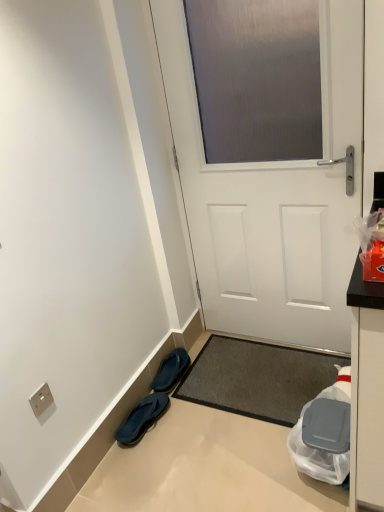
Question: Is blue rubber flip-flops at lower left, the second footwear in the front-to-back sequence, next to dark gray textured mat at center?

Choices:
 (A) yes
 (B) no

Answer: (B)

Question: Is blue rubber flip-flops at lower left, arranged as the first footwear when viewed from the back, far away from dark gray textured mat at center?

Choices:
 (A) no
 (B) yes

Answer: (A)

Question: From the image's perspective, is blue rubber flip-flops at lower left, arranged as the first footwear when viewed from the back, below dark gray textured mat at center?

Choices:
 (A) yes
 (B) no

Answer: (B)

Question: Can dark gray textured mat at center be found inside blue rubber flip-flops at lower left, the second footwear in the front-to-back sequence?

Choices:
 (A) no
 (B) yes

Answer: (A)

Question: Is blue rubber flip-flops at lower left, the second footwear in the front-to-back sequence, shorter than dark gray textured mat at center?

Choices:
 (A) no
 (B) yes

Answer: (A)

Question: Is blue rubber flip-flops at lower left, arranged as the first footwear when viewed from the back, in front of or behind white matte door at center in the image?

Choices:
 (A) behind
 (B) front

Answer: (A)

Question: From a real-world perspective, is blue rubber flip-flops at lower left, the second footwear in the front-to-back sequence, positioned above or below white matte door at center?

Choices:
 (A) above
 (B) below

Answer: (B)

Question: From the image's perspective, is blue rubber flip-flops at lower left, the second footwear in the front-to-back sequence, above or below white matte door at center?

Choices:
 (A) above
 (B) below

Answer: (B)

Question: From their relative heights in the image, would you say blue rubber flip-flops at lower left, the second footwear in the front-to-back sequence, is taller or shorter than white matte door at center?

Choices:
 (A) tall
 (B) short

Answer: (B)

Question: Is blue rubber flip-flops at lower left, the second footwear in the front-to-back sequence, in front of or behind silver metallic electric outlet at lower left in the image?

Choices:
 (A) front
 (B) behind

Answer: (B)

Question: Is point (180, 353) positioned closer to the camera than point (39, 409)?

Choices:
 (A) closer
 (B) farther

Answer: (B)

Question: Based on their positions, is blue rubber flip-flops at lower left, arranged as the first footwear when viewed from the back, located to the left or right of silver metallic electric outlet at lower left?

Choices:
 (A) left
 (B) right

Answer: (B)

Question: Do you think blue rubber flip-flops at lower left, the second footwear in the front-to-back sequence, is within silver metallic electric outlet at lower left, or outside of it?

Choices:
 (A) inside
 (B) outside

Answer: (B)

Question: Choose the correct answer: Is blue rubber flip-flops at lower left, which is the 2th footwear in back-to-front order, inside dark gray textured mat at center or outside it?

Choices:
 (A) inside
 (B) outside

Answer: (B)

Question: From the image's perspective, is blue rubber flip-flops at lower left, the 1th footwear viewed from the front, located above or below dark gray textured mat at center?

Choices:
 (A) below
 (B) above

Answer: (A)